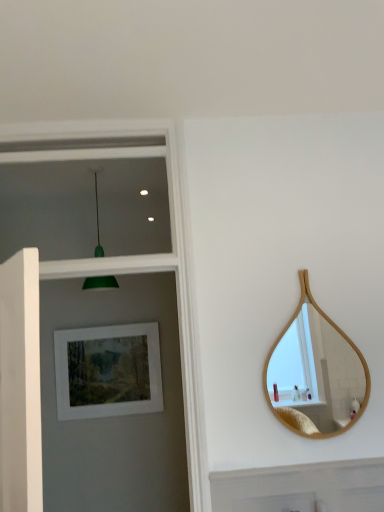
Question: Is bamboo mirror at right in front of matte white picture frame at upper left?

Choices:
 (A) yes
 (B) no

Answer: (A)

Question: Is bamboo mirror at right located outside matte white picture frame at upper left?

Choices:
 (A) yes
 (B) no

Answer: (A)

Question: Is bamboo mirror at right to the left of matte white picture frame at upper left from the viewer's perspective?

Choices:
 (A) yes
 (B) no

Answer: (B)

Question: Is the position of bamboo mirror at right more distant than that of matte white picture frame at upper left?

Choices:
 (A) yes
 (B) no

Answer: (B)

Question: Is bamboo mirror at right taller than matte white picture frame at upper left?

Choices:
 (A) no
 (B) yes

Answer: (B)

Question: In terms of size, does matte white picture frame at upper left appear bigger or smaller than bamboo mirror at right?

Choices:
 (A) small
 (B) big

Answer: (B)

Question: Is matte white picture frame at upper left in front of or behind bamboo mirror at right in the image?

Choices:
 (A) front
 (B) behind

Answer: (B)

Question: From a real-world perspective, relative to bamboo mirror at right, is matte white picture frame at upper left vertically above or below?

Choices:
 (A) above
 (B) below

Answer: (B)

Question: Considering the positions of matte white picture frame at upper left and bamboo mirror at right in the image, is matte white picture frame at upper left taller or shorter than bamboo mirror at right?

Choices:
 (A) tall
 (B) short

Answer: (B)

Question: Is bamboo mirror at right in front of or behind matte white picture frame at upper left in the image?

Choices:
 (A) front
 (B) behind

Answer: (A)

Question: From a real-world perspective, is bamboo mirror at right above or below matte white picture frame at upper left?

Choices:
 (A) below
 (B) above

Answer: (B)

Question: Based on their sizes in the image, would you say bamboo mirror at right is bigger or smaller than matte white picture frame at upper left?

Choices:
 (A) small
 (B) big

Answer: (A)

Question: Does point (321, 329) appear closer or farther from the camera than point (84, 356)?

Choices:
 (A) farther
 (B) closer

Answer: (A)

Question: In the image, is green matte pendant light at upper left positioned in front of or behind matte white picture frame at upper left?

Choices:
 (A) front
 (B) behind

Answer: (A)

Question: From their relative heights in the image, would you say green matte pendant light at upper left is taller or shorter than matte white picture frame at upper left?

Choices:
 (A) tall
 (B) short

Answer: (A)